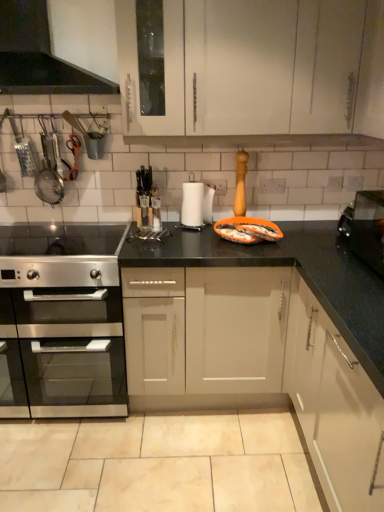
Question: Is stainless steel oven at left further to the viewer compared to satin silver gas stove at lower left?

Choices:
 (A) no
 (B) yes

Answer: (B)

Question: Is stainless steel oven at left thinner than satin silver gas stove at lower left?

Choices:
 (A) yes
 (B) no

Answer: (A)

Question: Could satin silver gas stove at lower left be considered to be inside stainless steel oven at left?

Choices:
 (A) yes
 (B) no

Answer: (B)

Question: Is stainless steel oven at left next to satin silver gas stove at lower left?

Choices:
 (A) no
 (B) yes

Answer: (A)

Question: From a real-world perspective, is stainless steel oven at left beneath satin silver gas stove at lower left?

Choices:
 (A) yes
 (B) no

Answer: (A)

Question: From the image's perspective, is stainless steel oven at left beneath satin silver gas stove at lower left?

Choices:
 (A) no
 (B) yes

Answer: (B)

Question: Is black stainless steel toaster at right, arranged as the 1th appliance when viewed from the front, bigger than orange plastic tray at center?

Choices:
 (A) no
 (B) yes

Answer: (B)

Question: Is black stainless steel toaster at right, positioned as the 2th appliance in back-to-front order, far from orange plastic tray at center?

Choices:
 (A) no
 (B) yes

Answer: (A)

Question: Is black stainless steel toaster at right, which is counted as the first appliance, starting from the bottom, looking in the opposite direction of orange plastic tray at center?

Choices:
 (A) no
 (B) yes

Answer: (A)

Question: Considering the relative sizes of black stainless steel toaster at right, which ranks as the first appliance in right-to-left order, and orange plastic tray at center in the image provided, is black stainless steel toaster at right, which ranks as the first appliance in right-to-left order, thinner than orange plastic tray at center?

Choices:
 (A) yes
 (B) no

Answer: (A)

Question: Is black stainless steel toaster at right, which is counted as the 2th appliance, starting from the top, directly adjacent to orange plastic tray at center?

Choices:
 (A) no
 (B) yes

Answer: (A)

Question: From the image's perspective, is black stainless steel toaster at right, which ranks as the first appliance in right-to-left order, over orange plastic tray at center?

Choices:
 (A) no
 (B) yes

Answer: (A)

Question: Would you say metallic strainer at left, the 1th appliance from the top, is outside orange plastic tray at center?

Choices:
 (A) no
 (B) yes

Answer: (B)